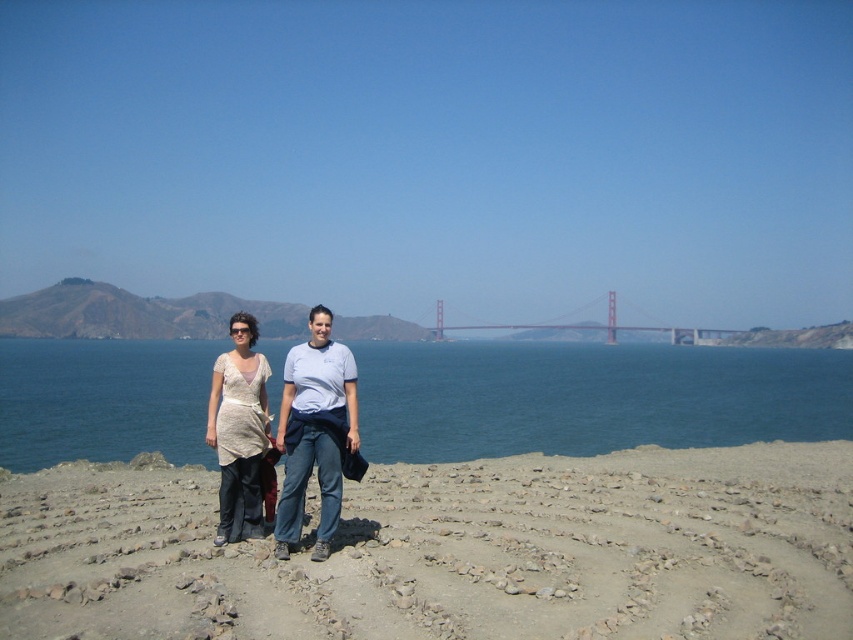
You are a photographer standing at the edge of the rocky terrain. You want to capture a photo of the gray gravel at center while also including the Golden Gate Bridge in the background. Based on the distance, will you need to adjust your camera focus to ensure both the gravel and the bridge are in focus?

The gray gravel at center is 6.34 meters from the camera. To ensure both the gravel and the distant Golden Gate Bridge are in focus, you should adjust your camera focus to a point that creates a deep depth of field, ideally focusing around the gravel and allowing the bridge to remain sharp in the background.

You are planning to build a small garden path using the gray gravel at center and the red painted steel bridge at center. Which material has a greater width to use for a wider walkway?

The red painted steel bridge at center has a greater width than the gray gravel at center, so it would be suitable for a wider walkway.